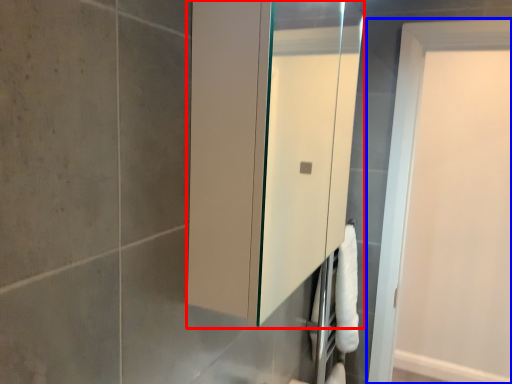
Question: Which point is closer to the camera, medicine cabinet (highlighted by a red box) or door (highlighted by a blue box)?

Choices:
 (A) medicine cabinet
 (B) door

Answer: (A)